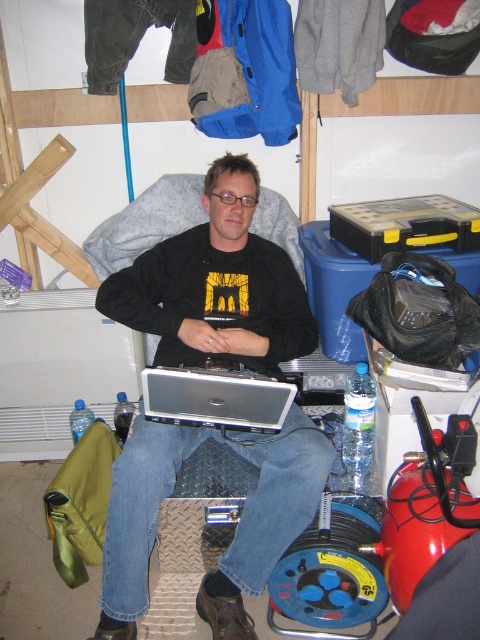
You are organizing a workspace and need to place two laptops side by side. The black matte laptop at center and the silver metallic laptop at center must be arranged so that the black one is on the left. Are they currently positioned correctly according to the image?

Yes, the black matte laptop at center is already positioned to the left of the silver metallic laptop at center, so they are correctly arranged as required.

You are standing in a workshop and want to reach a specific point in the scene. The point is located at coordinates point (238, 166). Considering your height is 1.7 meters, can you safely reach that point without needing a stool?

The point (238, 166) is 1.86 meters from viewer. Since your height is 1.7 meters, you cannot safely reach that point without a stool as it is slightly higher than your maximum reach.